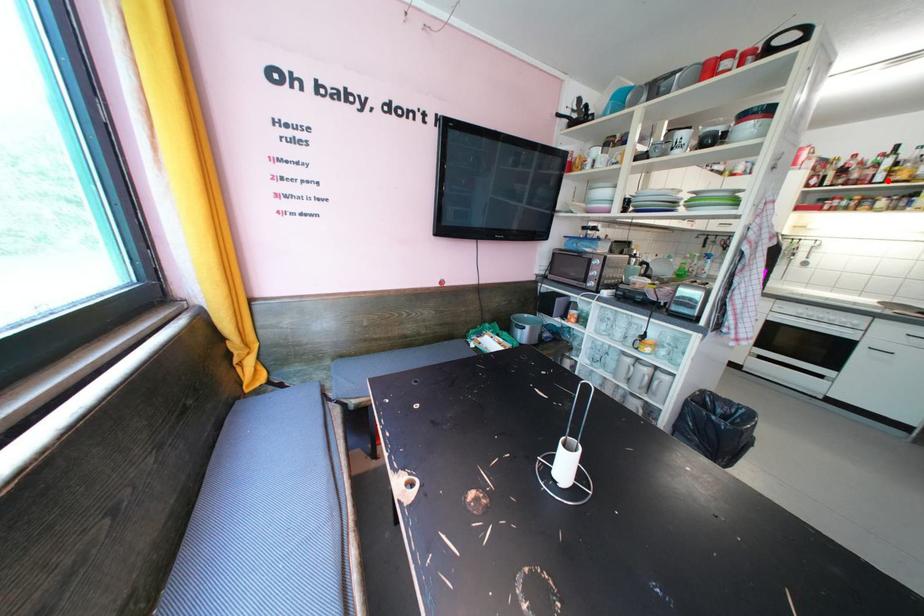
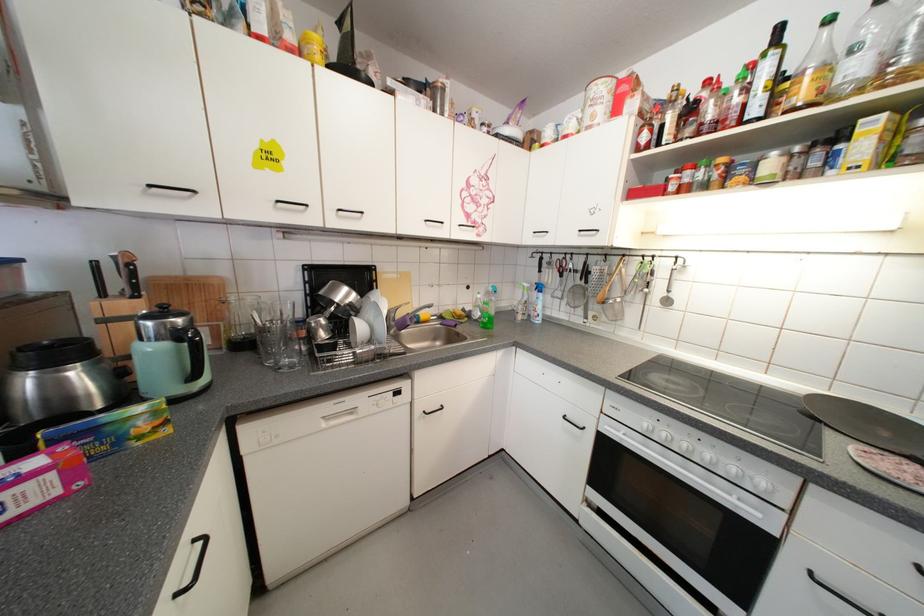
Question: I am providing you with two images of the same scene from different viewpoints. Given a red point in image1, look at the same physical point in image2. Is it:

Choices:
 (A) Closer to the viewpoint
 (B) Farther from the viewpoint

Answer: (A)